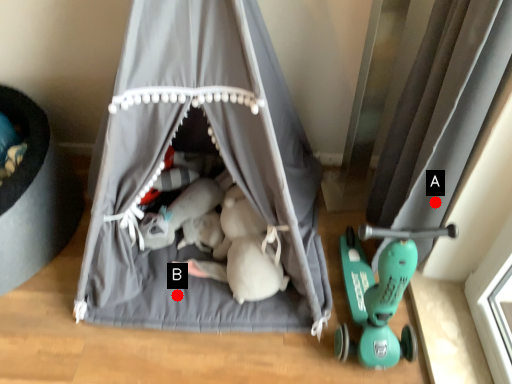
Question: Two points are circled on the image, labeled by A and B beside each circle. Which of the following is the farthest from the observer?

Choices:
 (A) A is further
 (B) B is further

Answer: (B)